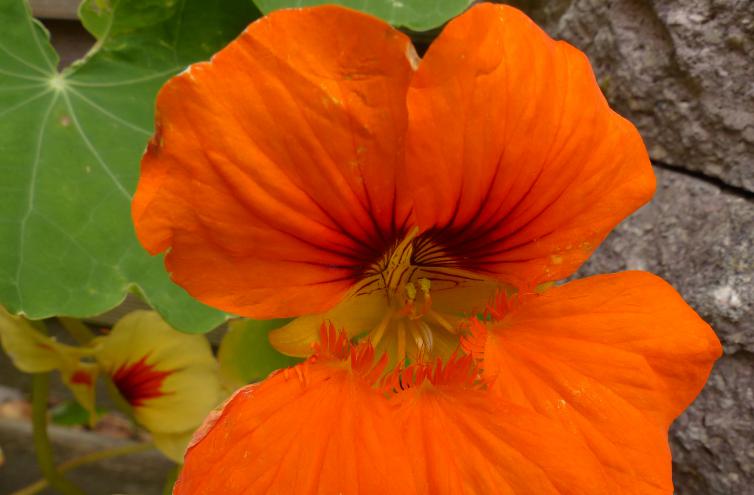
This screenshot has width=754, height=495. Find the location of `lower wall edge`. lower wall edge is located at coordinates (691, 221).